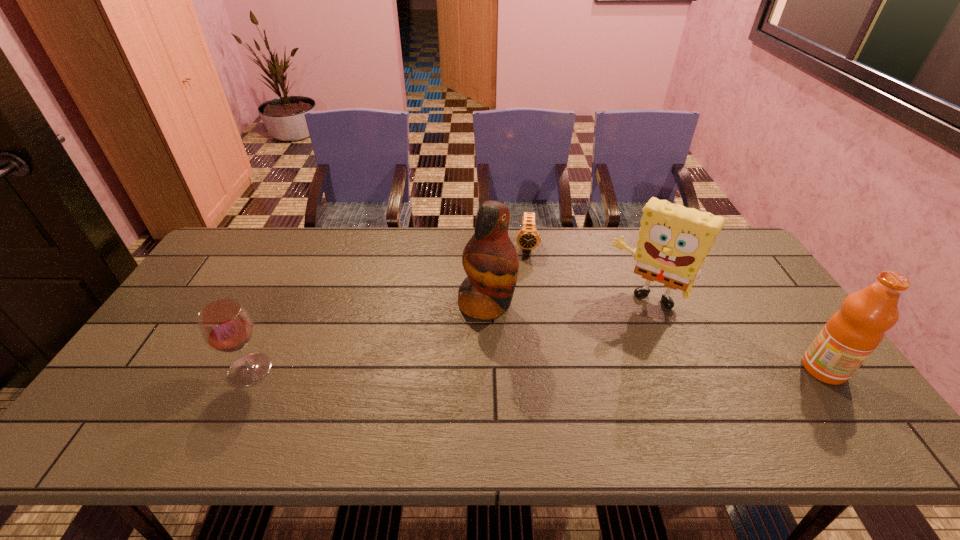
Where is `fruit juice located at the near edge`? fruit juice located at the near edge is located at coordinates (848, 338).

Locate an element on the screen. This screenshot has width=960, height=540. object located in the right edge section of the desktop is located at coordinates (848, 338).

Where is `object at the near right corner`? This screenshot has height=540, width=960. object at the near right corner is located at coordinates (848, 338).

Locate an element on the screen. vacant space at the far edge of the desktop is located at coordinates (423, 261).

In the image, there is a desktop. Identify the location of vacant space at the near edge. click(703, 393).

In the image, there is a desktop. Find the location of `free region at the left edge`. free region at the left edge is located at coordinates (138, 361).

Locate an element on the screen. vacant area at the right edge is located at coordinates (773, 320).

The height and width of the screenshot is (540, 960). I want to click on vacant space at the far left corner of the desktop, so click(278, 227).

The image size is (960, 540). Identify the location of blank area at the near right corner. (797, 383).

The width and height of the screenshot is (960, 540). Identify the location of free spot between the rightmost object and the watch. (675, 307).